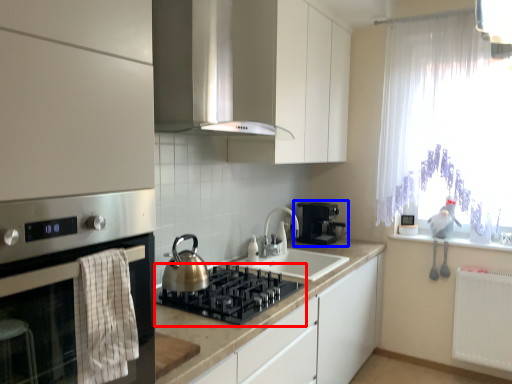
Question: Among these objects, which one is farthest to the camera, gas stove (highlighted by a red box) or coffee machine (highlighted by a blue box)?

Choices:
 (A) gas stove
 (B) coffee machine

Answer: (B)